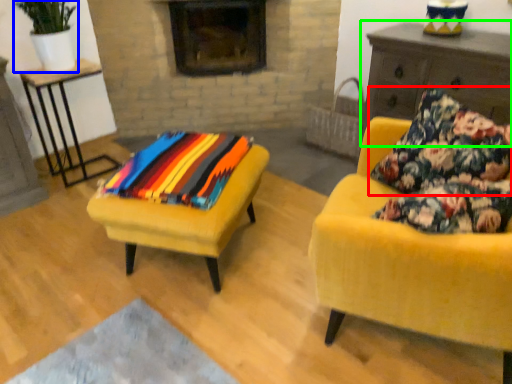
Question: Which object is positioned closest to pillow (highlighted by a red box)? Select from houseplant (highlighted by a blue box) and dresser (highlighted by a green box).

Choices:
 (A) houseplant
 (B) dresser

Answer: (B)